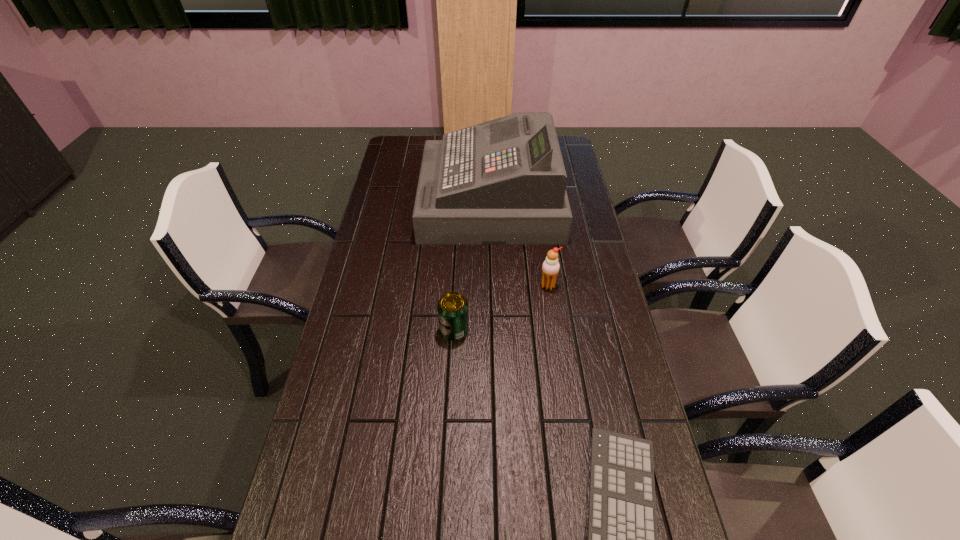
What are the coordinates of `object that is positioned at the right edge` in the screenshot? It's located at (503, 182).

Find the location of a particular element. The height and width of the screenshot is (540, 960). free space at the left edge is located at coordinates (390, 312).

In the image, there is a desktop. At what (x,y) coordinates should I click in order to perform the action: click on vacant space at the far left corner. Please return your answer as a coordinate pair (x, y). This screenshot has height=540, width=960. Looking at the image, I should click on (415, 160).

Where is `free spot between the second shortest object and the third shortest object`? This screenshot has width=960, height=540. free spot between the second shortest object and the third shortest object is located at coordinates (501, 308).

You are a GUI agent. You are given a task and a screenshot of the screen. Output one action in this format:
    pyautogui.click(x=<x>, y=<y>)
    Task: Click on the vacant area that lies between the second nearest object and the farthest object
    The height and width of the screenshot is (540, 960).
    Given the screenshot: What is the action you would take?
    pyautogui.click(x=472, y=266)

This screenshot has width=960, height=540. In order to click on vacant area that lies between the second nearest object and the tallest object in this screenshot , I will do `click(472, 266)`.

Locate an element on the screen. empty location between the tallest object and the beer can is located at coordinates (472, 266).

Locate which object is the third closest to the second tallest object. Please provide its 2D coordinates. Your answer should be formatted as a tuple, i.e. [(x, y)], where the tuple contains the x and y coordinates of a point satisfying the conditions above.

[(622, 539)]

The height and width of the screenshot is (540, 960). Identify the location of object identified as the third closest to the third nearest object. (622, 539).